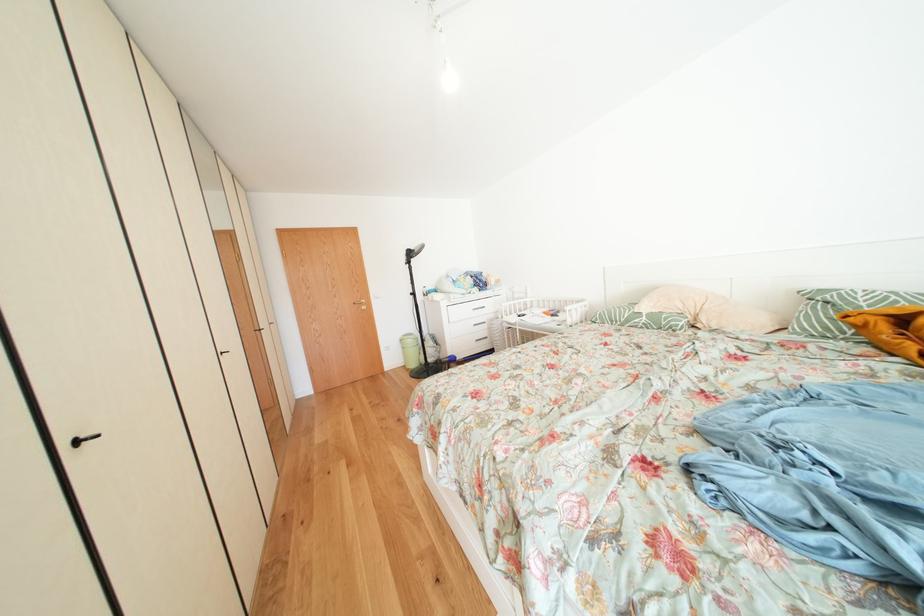
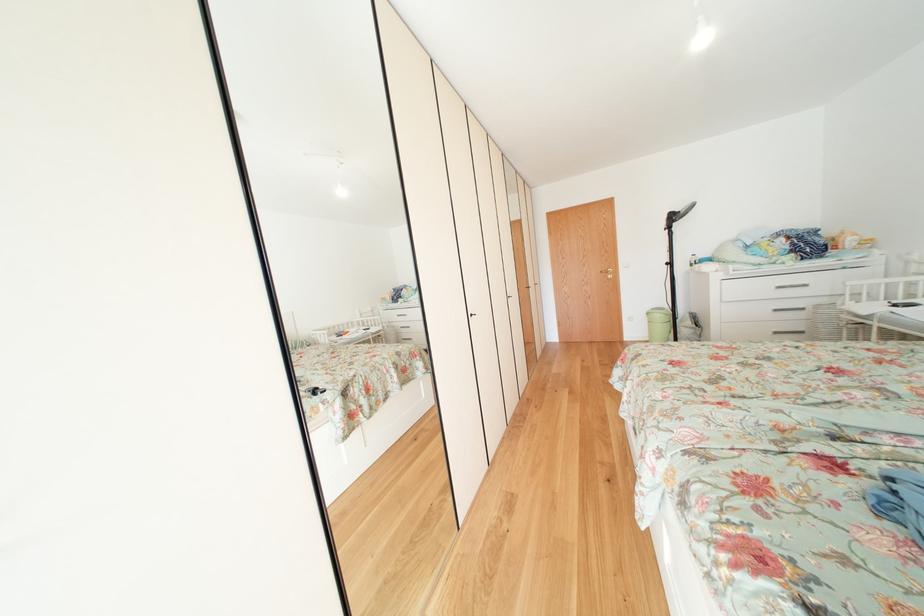
Find the pixel in the second image that matches (x=487, y=345) in the first image.

(784, 338)